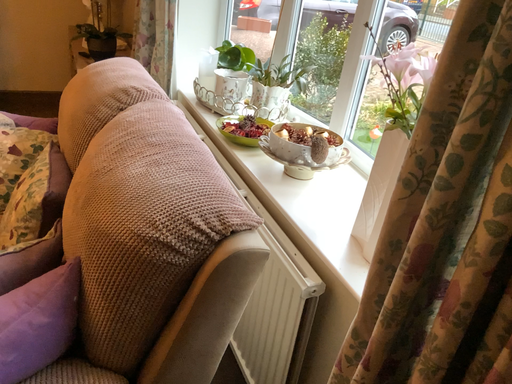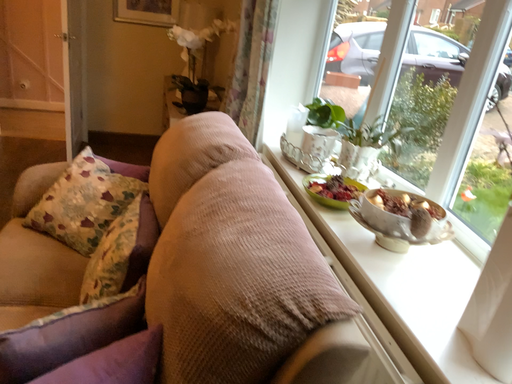
Question: Which way did the camera rotate in the video?

Choices:
 (A) rotated left
 (B) rotated right

Answer: (A)